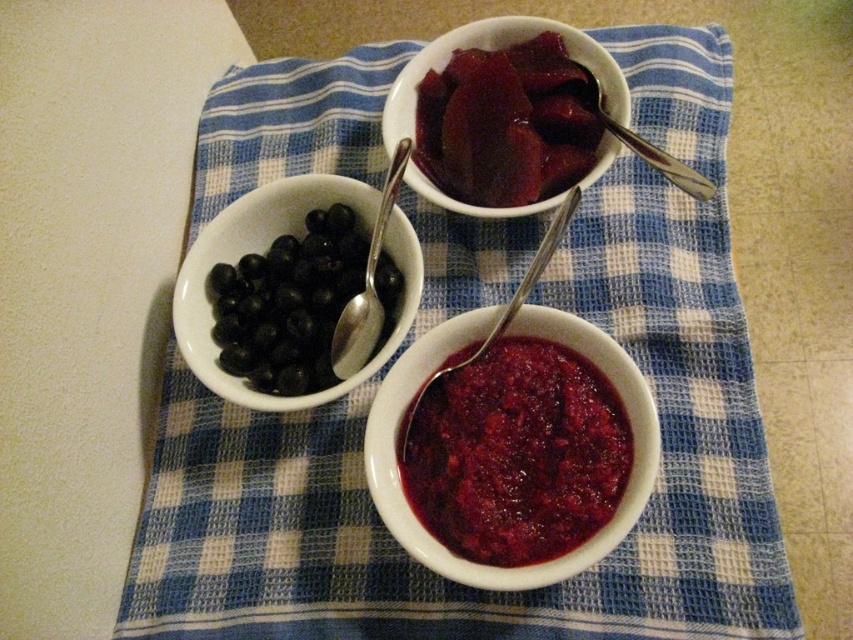
In the scene shown: You are trying to place the metallic silver spoon at center into the matte ceramic bowl at center. Will the spoon fit inside the bowl?

The matte ceramic bowl at center is wider than the metallic silver spoon at center, so the spoon will fit inside the bowl.

You are setting up a table for a small gathering and have two spoons to choose from. The silver metallic spoon at upper right and the metallic silver spoon at center. Which spoon is shorter in height?

The silver metallic spoon at upper right is shorter in height compared to the metallic silver spoon at center.